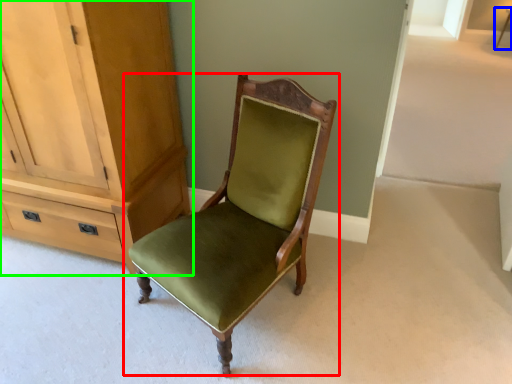
Question: Which object is the closest to the chair (highlighted by a red box)? Choose among these: side table (highlighted by a blue box) or cabinetry (highlighted by a green box).

Choices:
 (A) side table
 (B) cabinetry

Answer: (B)